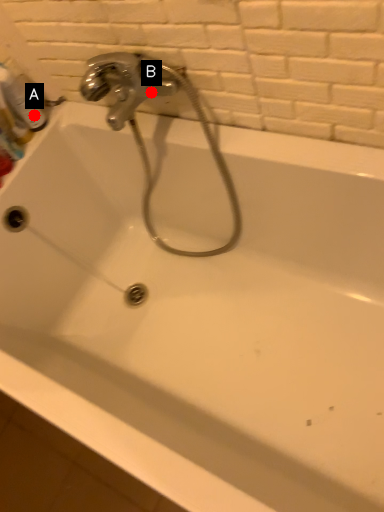
Question: Two points are circled on the image, labeled by A and B beside each circle. Among these points, which one is nearest to the camera?

Choices:
 (A) A is closer
 (B) B is closer

Answer: (B)